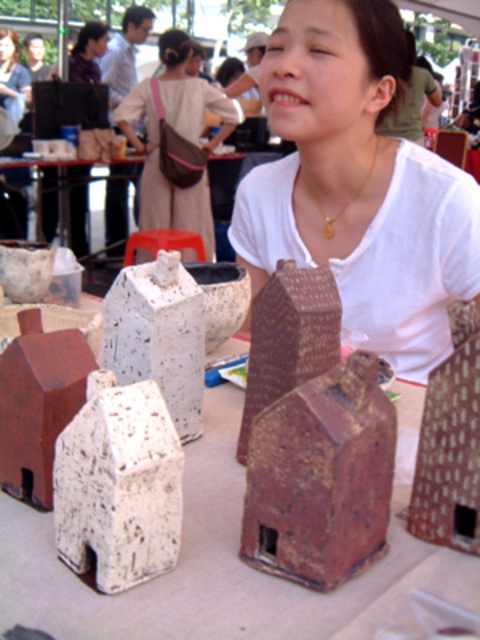
You are a customer at the market and want to buy both the matte brown bag at upper center and the gold metallic necklace at center. The vendor says you can only take the larger item. Which one should you choose?

You should choose the matte brown bag at upper center because it is bigger than the gold metallic necklace at center according to the description.

You are a customer at the market and want to buy the ceramic house located at point (x=189, y=252). To reach it, you must pass through the area near point (x=349, y=202). Will you encounter any obstacles along the way?

Point (x=189, y=252) is behind point (x=349, y=202), so you will encounter an obstacle at point (x=349, y=202) along the way.